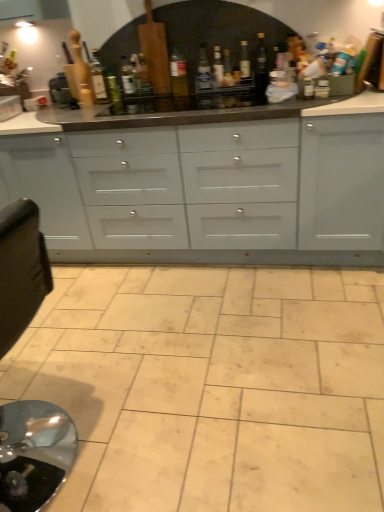
Where is `vacant space to the right of black leather swivel chair at left`? This screenshot has height=512, width=384. vacant space to the right of black leather swivel chair at left is located at coordinates (165, 429).